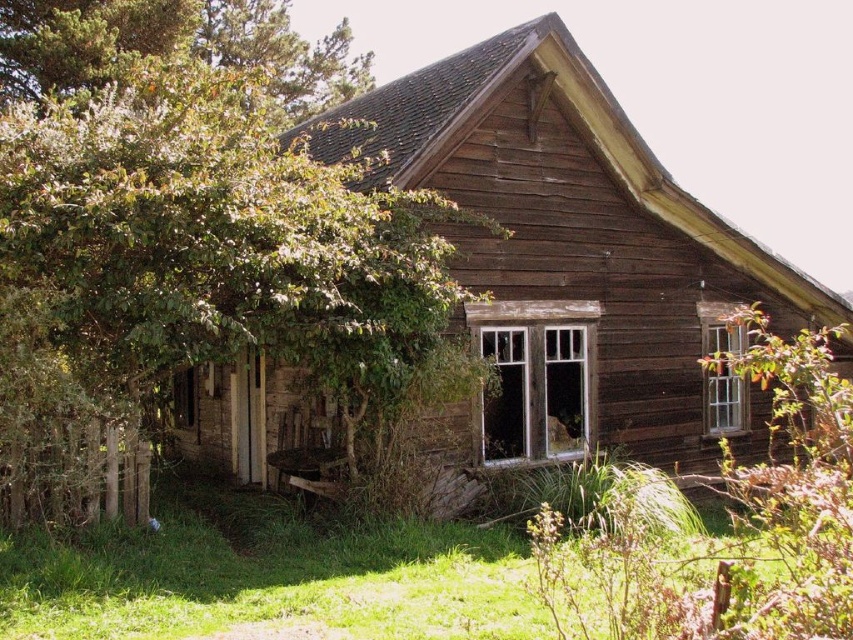
You are standing in front of the old wooden house. There is a point marked at coordinates point [573,260]. Can you tell me what this point represents?

The point [573,260] represents the weathered wood cabin at center.

You are standing in front of the old wooden house and want to know which object occupies more horizontal space in the scene. Based on the green leafy tree at upper left and the green grass at lower center, which one is wider?

The green leafy tree at upper left is wider than the green grass at lower center because its width surpasses the grass.